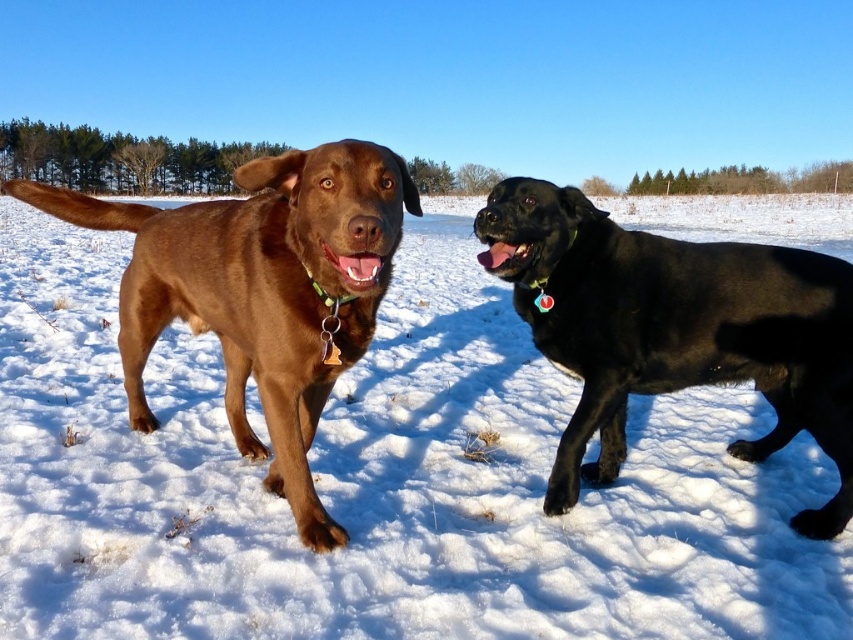
Between point (764, 285) and point (238, 211), which one is positioned in front?

Point (238, 211)

In the scene shown: Is black glossy dog at right smaller than matte brown dog at left?

Correct, black glossy dog at right occupies less space than matte brown dog at left.

What do you see at coordinates (674, 330) in the screenshot? The image size is (853, 640). I see `black glossy dog at right` at bounding box center [674, 330].

This screenshot has height=640, width=853. What are the coordinates of `black glossy dog at right` in the screenshot? It's located at (674, 330).

Can you confirm if white fluffy snow at center is positioned to the left of black glossy dog at right?

No, white fluffy snow at center is not to the left of black glossy dog at right.

Is white fluffy snow at center further to the viewer compared to black glossy dog at right?

No, it is not.

What do you see at coordinates (379, 480) in the screenshot? Image resolution: width=853 pixels, height=640 pixels. I see `white fluffy snow at center` at bounding box center [379, 480].

The image size is (853, 640). I want to click on white fluffy snow at center, so click(x=379, y=480).

Who is lower down, white fluffy snow at center or matte brown dog at left?

matte brown dog at left is below.

Is point (637, 588) in front of point (300, 292)?

That is False.

Who is more forward, (44, 262) or (369, 328)?

Positioned in front is point (369, 328).

I want to click on white fluffy snow at center, so click(379, 480).